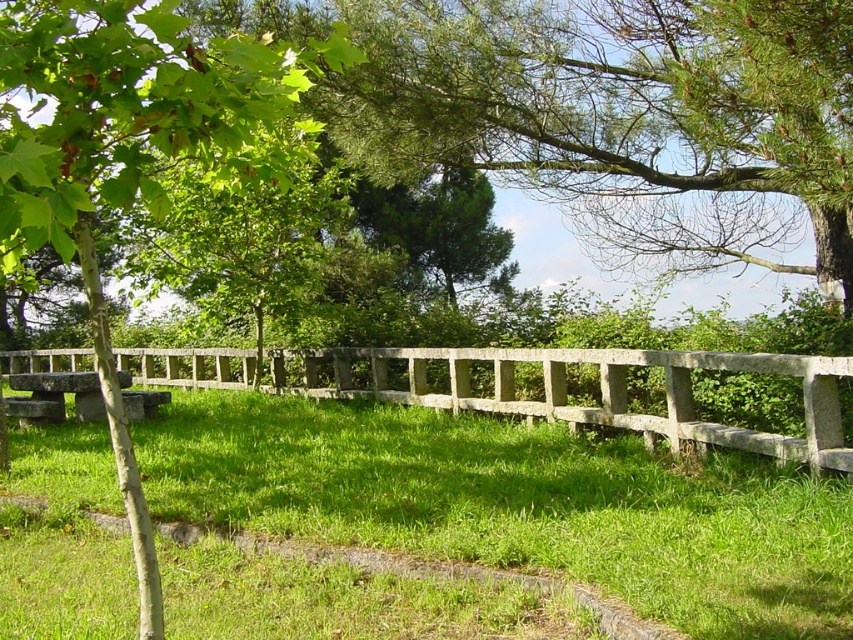
Question: Is green leafy tree at left further to the viewer compared to gray stone fence at center?

Choices:
 (A) no
 (B) yes

Answer: (A)

Question: Is green grassy at center positioned behind green leafy tree at left?

Choices:
 (A) yes
 (B) no

Answer: (A)

Question: Which of the following is the closest to the observer?

Choices:
 (A) (44, 378)
 (B) (96, 285)
 (C) (264, 488)
 (D) (62, 365)

Answer: (B)

Question: Which object appears closest to the camera in this image?

Choices:
 (A) green leafy tree at left
 (B) smooth gray stone bench at left

Answer: (A)

Question: Can you confirm if green grassy at center is bigger than gray stone fence at center?

Choices:
 (A) yes
 (B) no

Answer: (B)

Question: Which point is closer to the camera?

Choices:
 (A) smooth gray stone bench at left
 (B) green leafy tree at left
 (C) gray stone fence at center

Answer: (B)